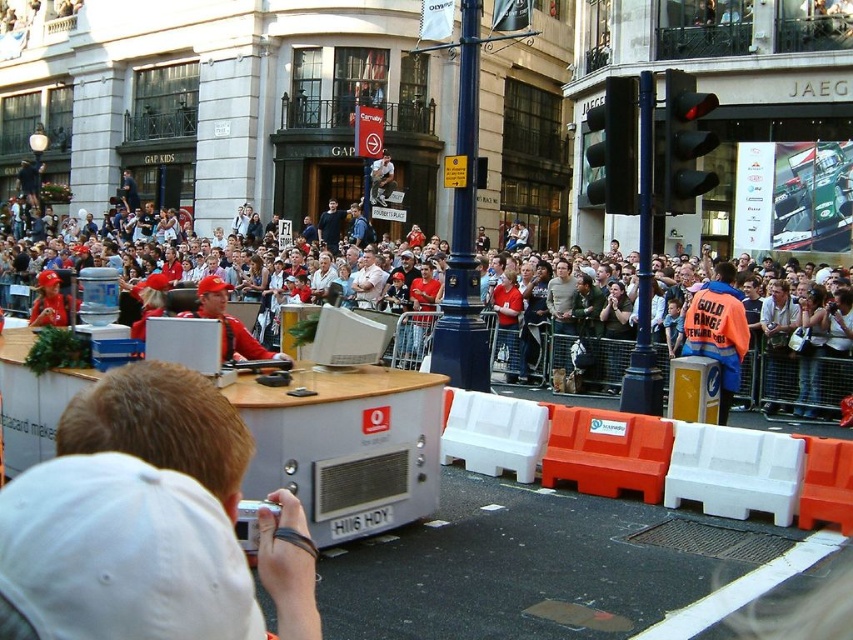
Between orange reflective jacket at center and dark blue shirt at center, which one is positioned lower?

orange reflective jacket at center

Is orange reflective jacket at center above dark blue shirt at center?

No.

What do you see at coordinates (718, 332) in the screenshot?
I see `orange reflective jacket at center` at bounding box center [718, 332].

Image resolution: width=853 pixels, height=640 pixels. In order to click on orange reflective jacket at center in this screenshot , I will do point(718,332).

Who is shorter, matte red shirts at center or dark blue shirt at center?

With less height is dark blue shirt at center.

Between matte red shirts at center and dark blue shirt at center, which one is positioned higher?

dark blue shirt at center

This screenshot has width=853, height=640. In order to click on matte red shirts at center in this screenshot , I will do `click(763, 346)`.

What are the coordinates of `matte red shirts at center` in the screenshot? It's located at (763, 346).

Measure the distance between matte red shirts at center and orange reflective jacket at center.

matte red shirts at center and orange reflective jacket at center are 48.95 feet apart.

Between matte red shirts at center and orange reflective jacket at center, which one appears on the right side from the viewer's perspective?

orange reflective jacket at center is more to the right.

Is point (582, 336) more distant than point (724, 292)?

Yes.

Identify the location of matte red shirts at center. (763, 346).